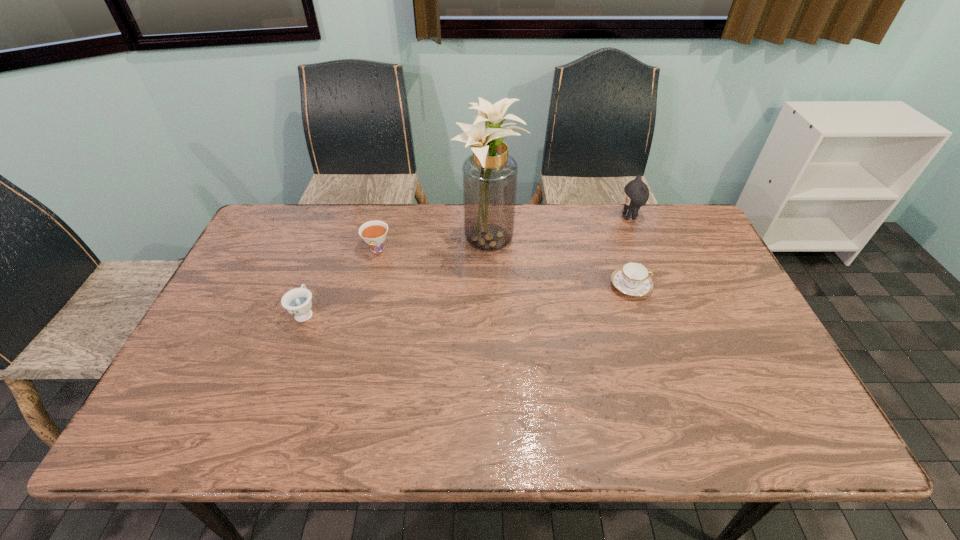
This screenshot has height=540, width=960. I want to click on flower arrangement, so click(x=490, y=175).

The width and height of the screenshot is (960, 540). Identify the location of the third object from left to right. (490, 175).

Locate an element on the screen. The height and width of the screenshot is (540, 960). the second tallest object is located at coordinates 636,193.

This screenshot has height=540, width=960. In order to click on the second teacup from left to right in this screenshot , I will do `click(374, 233)`.

Locate an element on the screen. the fourth object from right to left is located at coordinates (374, 233).

At what (x,y) coordinates should I click in order to perform the action: click on the leftmost teacup. Please return your answer as a coordinate pair (x, y). Looking at the image, I should click on (297, 301).

This screenshot has width=960, height=540. I want to click on the rightmost teacup, so click(x=633, y=279).

The width and height of the screenshot is (960, 540). I want to click on the shortest object, so click(633, 279).

At what (x,y) coordinates should I click in order to perform the action: click on free spot located 0.180m on the right of the third object from left to right. Please return your answer as a coordinate pair (x, y). This screenshot has height=540, width=960. Looking at the image, I should click on (581, 242).

At what (x,y) coordinates should I click in order to perform the action: click on free location located 0.250m on the front-facing side of the second tallest object. Please return your answer as a coordinate pair (x, y). Looking at the image, I should click on (544, 217).